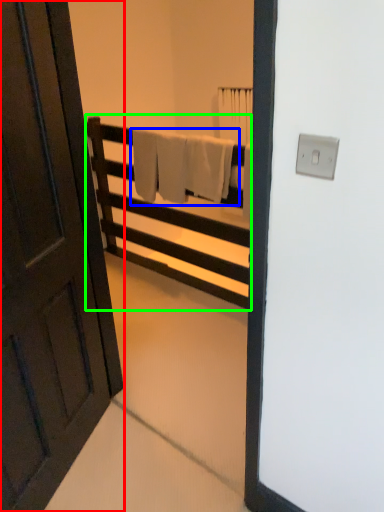
Question: Which object is positioned farthest from door (highlighted by a red box)? Select from bath towel (highlighted by a blue box) and furniture (highlighted by a green box).

Choices:
 (A) bath towel
 (B) furniture

Answer: (B)